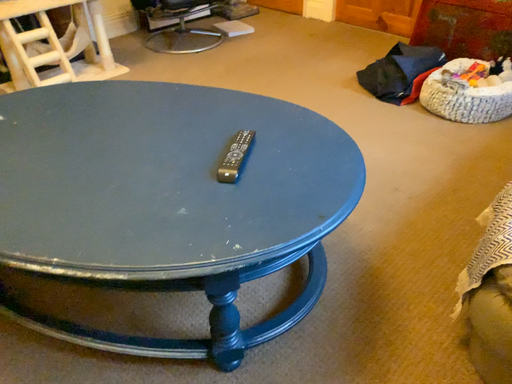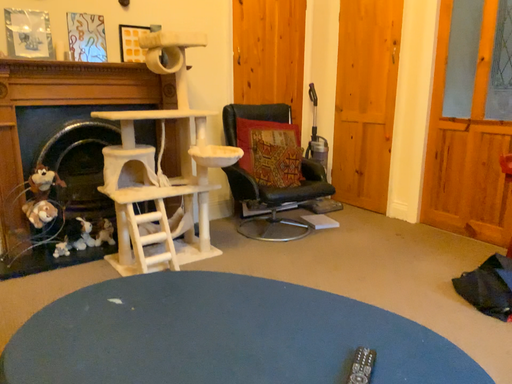
Question: Which way did the camera rotate in the video?

Choices:
 (A) rotated upward
 (B) rotated downward

Answer: (A)